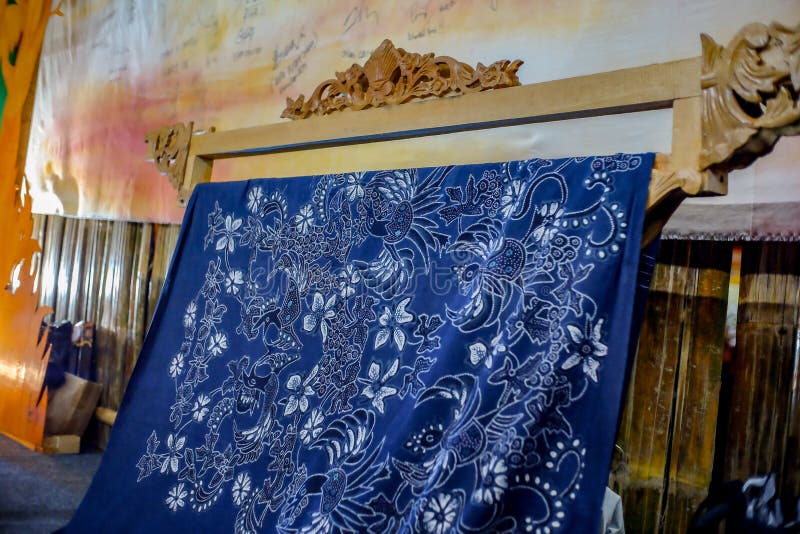
The image size is (800, 534). Identify the location of left side of shelf. (x=178, y=140).